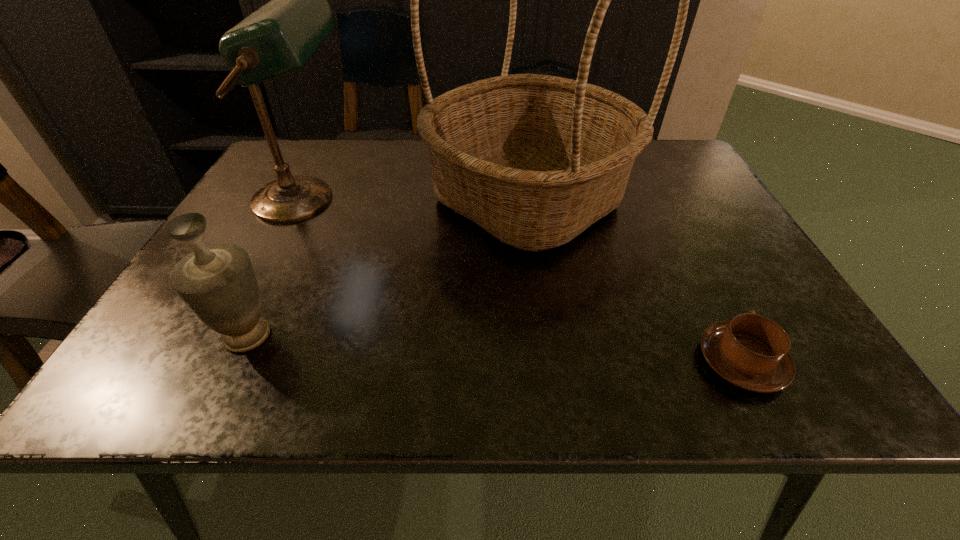
Where is `vacant point located 0.270m on the side of the shortest object with the handle`? vacant point located 0.270m on the side of the shortest object with the handle is located at coordinates [677, 235].

Identify the location of free location located on the side of the shortest object with the handle. Image resolution: width=960 pixels, height=540 pixels. (688, 259).

The width and height of the screenshot is (960, 540). In order to click on basket located at the far edge in this screenshot , I will do `click(534, 160)`.

Find the location of `table lamp located at the far edge`. table lamp located at the far edge is located at coordinates (278, 38).

You are a GUI agent. You are given a task and a screenshot of the screen. Output one action in this format:
    pyautogui.click(x=<x>, y=<y>)
    Task: Click on the urn present at the near edge
    This screenshot has height=540, width=960.
    Given the screenshot: What is the action you would take?
    pyautogui.click(x=217, y=283)

Where is `cappuccino positioned at the near edge`? Image resolution: width=960 pixels, height=540 pixels. cappuccino positioned at the near edge is located at coordinates (751, 352).

Where is `table lamp located in the left edge section of the desktop`? The width and height of the screenshot is (960, 540). table lamp located in the left edge section of the desktop is located at coordinates (278, 38).

Find the location of a particular element. urn that is positioned at the left edge is located at coordinates (217, 283).

The width and height of the screenshot is (960, 540). I want to click on object that is at the right edge, so click(x=751, y=352).

Where is `object present at the far left corner`? object present at the far left corner is located at coordinates (278, 38).